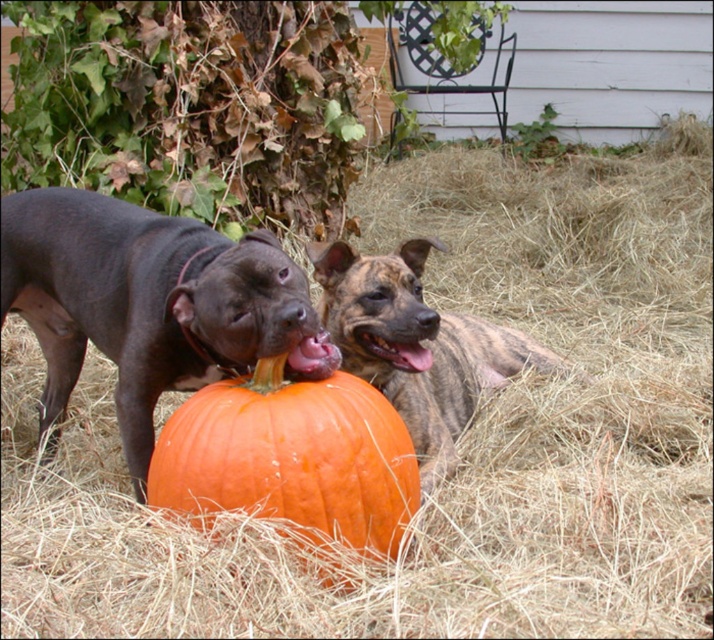
Does orange matte pumpkin at center appear over brindle fur dog at center?

Actually, orange matte pumpkin at center is below brindle fur dog at center.

Does orange matte pumpkin at center appear under brindle fur dog at center?

Yes.

The width and height of the screenshot is (714, 640). In order to click on orange matte pumpkin at center in this screenshot , I will do `click(291, 458)`.

This screenshot has width=714, height=640. Find the location of `orange matte pumpkin at center`. orange matte pumpkin at center is located at coordinates (291, 458).

Does black smooth dog at center have a lesser height compared to brindle fur dog at center?

No.

Between black smooth dog at center and brindle fur dog at center, which one appears on the right side from the viewer's perspective?

From the viewer's perspective, brindle fur dog at center appears more on the right side.

At what (x,y) coordinates should I click in order to perform the action: click on black smooth dog at center. Please return your answer as a coordinate pair (x, y). This screenshot has width=714, height=640. Looking at the image, I should click on (149, 304).

Does black smooth dog at center appear under orange matte pumpkin at center?

No.

Consider the image. Is black smooth dog at center taller than orange matte pumpkin at center?

Yes.

What do you see at coordinates (149, 304) in the screenshot? The width and height of the screenshot is (714, 640). I see `black smooth dog at center` at bounding box center [149, 304].

Locate an element on the screen. This screenshot has height=640, width=714. black smooth dog at center is located at coordinates (149, 304).